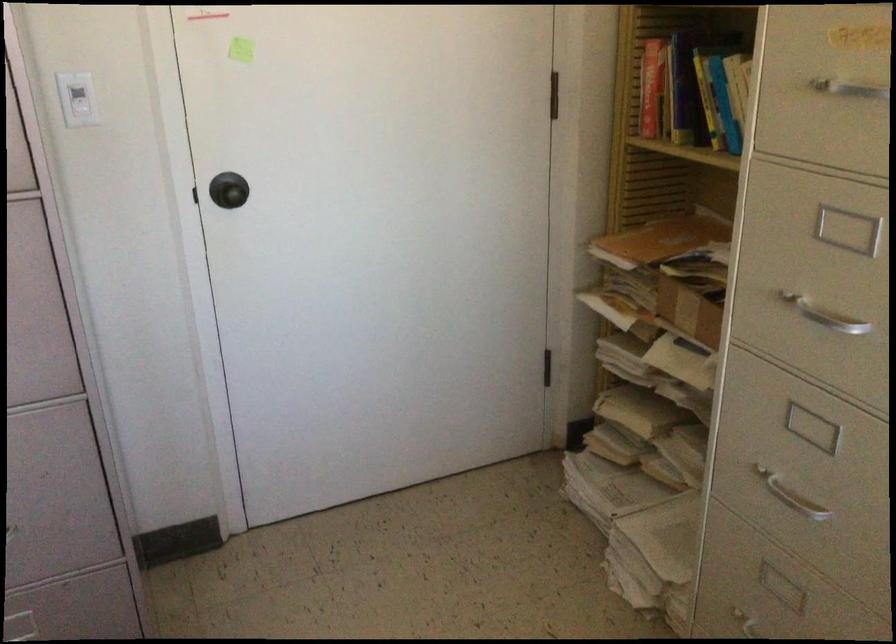
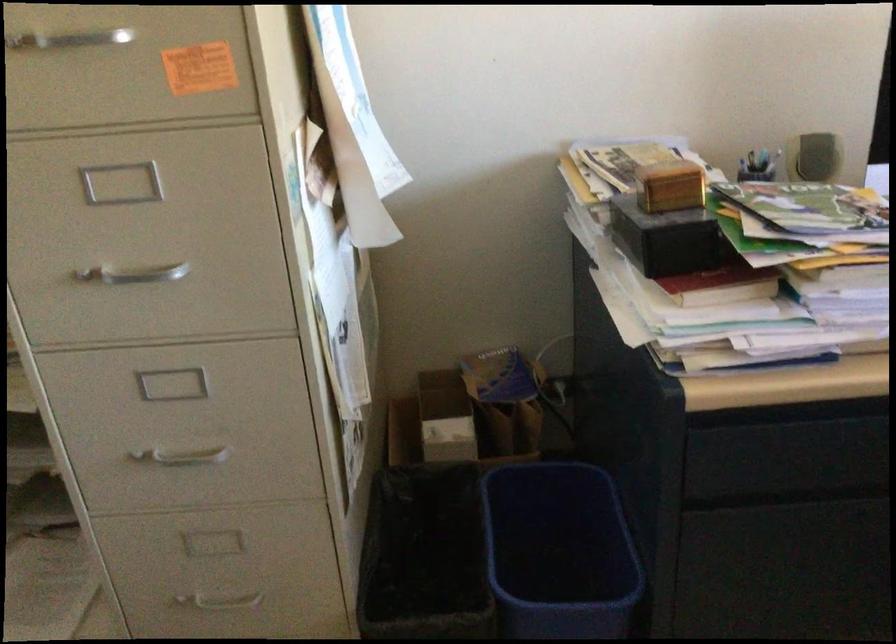
Find the pixel in the second image that matches point 817,323 in the first image.

(134, 274)